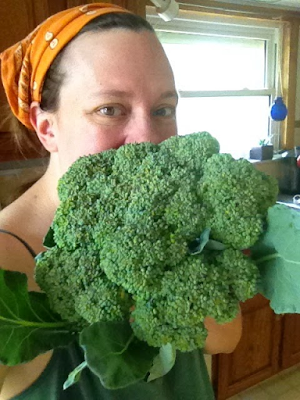
At what (x,y) coordinates should I click in order to perform the action: click on window. Please return your answer as a coordinate pair (x, y). The height and width of the screenshot is (400, 300). Looking at the image, I should click on [x=234, y=117].